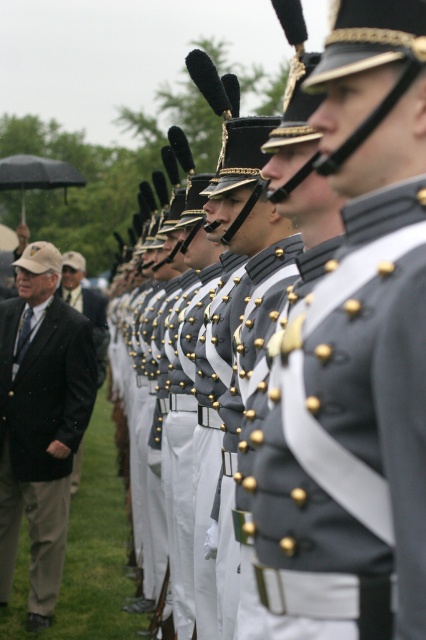
Question: Which object is positioned farthest from the gray matte uniform at center?

Choices:
 (A) black matte umbrella at left
 (B) black wool jacket at left
 (C) black wool suit at left

Answer: (A)

Question: Does gray matte uniform at center appear over black wool jacket at left?

Choices:
 (A) yes
 (B) no

Answer: (B)

Question: Among these points, which one is nearest to the camera?

Choices:
 (A) (394, 486)
 (B) (0, 509)
 (C) (23, 172)
 (D) (63, 264)

Answer: (A)

Question: Which point is closer to the camera?

Choices:
 (A) gray matte uniform at center
 (B) black matte umbrella at left
 (C) black wool suit at left
 (D) black wool jacket at left

Answer: (A)

Question: Does gray matte uniform at center appear on the right side of black wool suit at left?

Choices:
 (A) yes
 (B) no

Answer: (A)

Question: Does black wool suit at left have a greater width compared to black wool jacket at left?

Choices:
 (A) no
 (B) yes

Answer: (A)